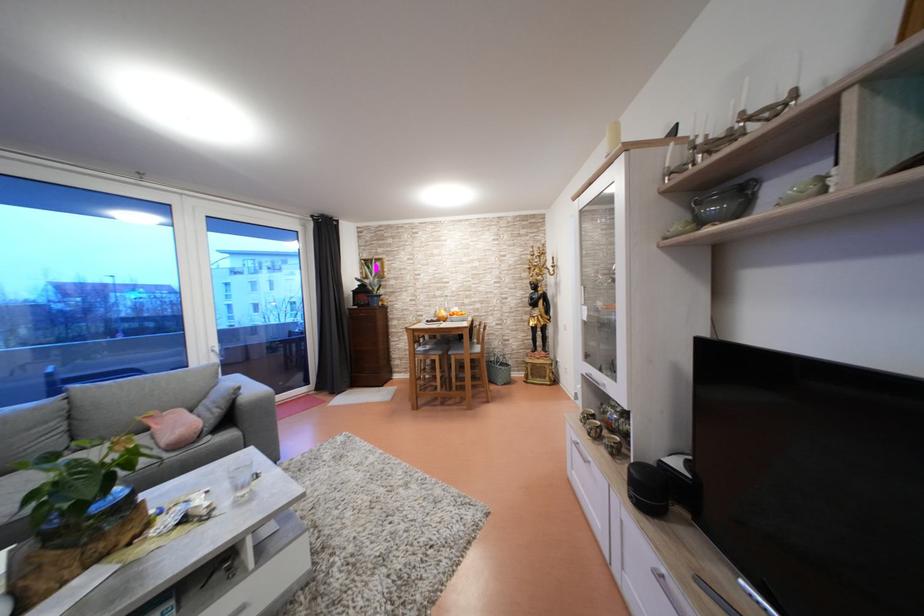
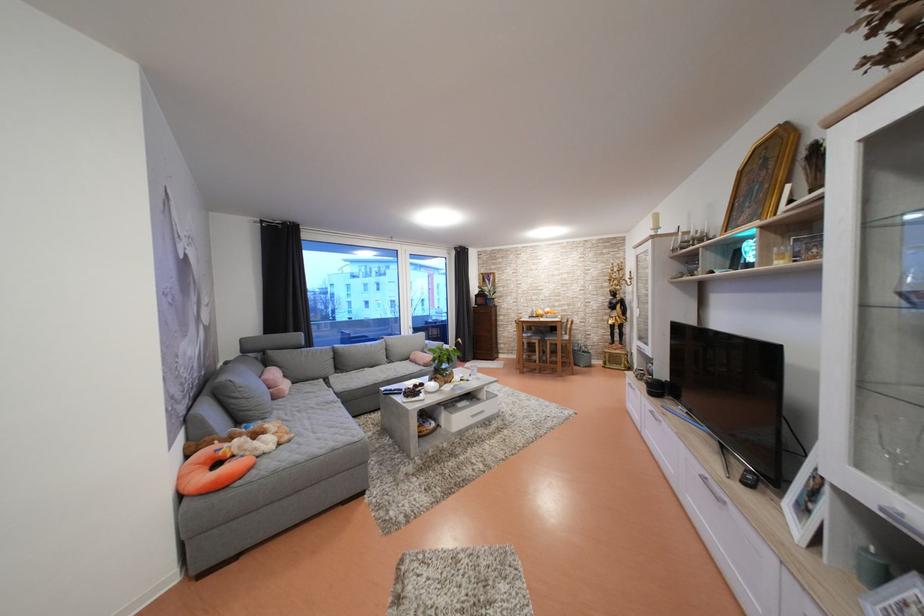
Locate, in the second image, the point that corresponds to the point at 442,342 in the first image.

(538, 334)